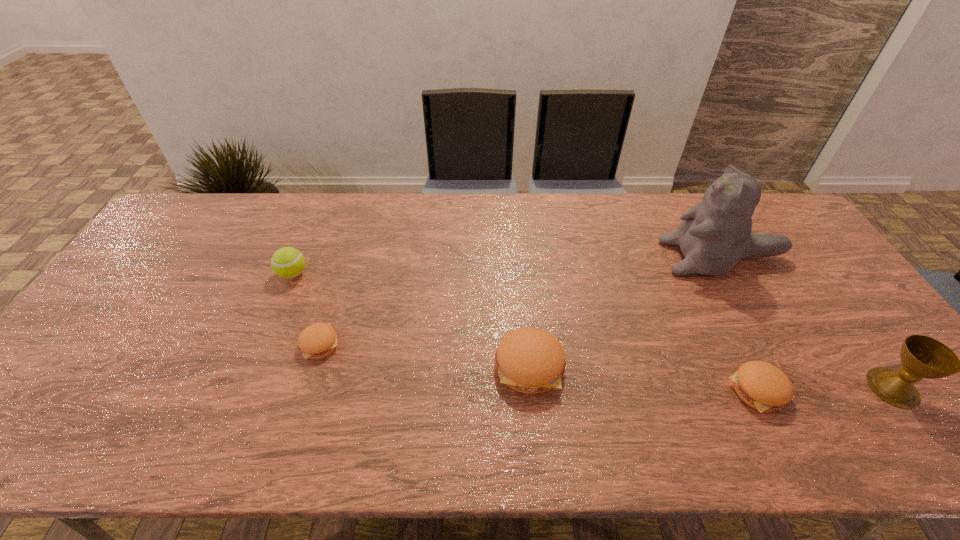
The pattys are evenly distributed in the image. To maintain this, where would you place another patty on the left? Please point to a free space. Please provide its 2D coordinates. Your answer should be formatted as a tuple, i.e. [(x, y)], where the tuple contains the x and y coordinates of a point satisfying the conditions above.

[(127, 323)]